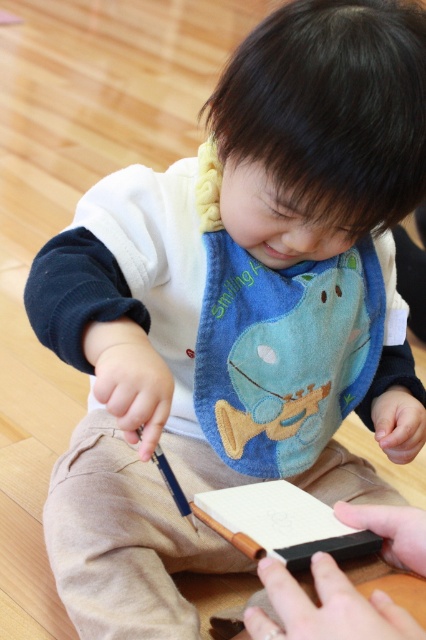
You are a teacher observing a child in an art class. The child is sitting at a table with a white matte notebook at center and a black matte pencil at center. Which object is closer to the child?

The white matte notebook at center is closer to the child because it is in front of the black matte pencil at center.

Looking at this image, you are a teacher observing a child in an art class. The child has a white matte notebook at center and a black matte pencil at center. Which object is closer to the child?

The white matte notebook at center is closer to the child because it is located above the black matte pencil at center, indicating it is positioned nearer in the scene.

You are a teacher observing a child in an art class. The child has a white matte notebook at center and a black matte pencil at center. Which object is wider?

The white matte notebook at center might be wider than the black matte pencil at center.